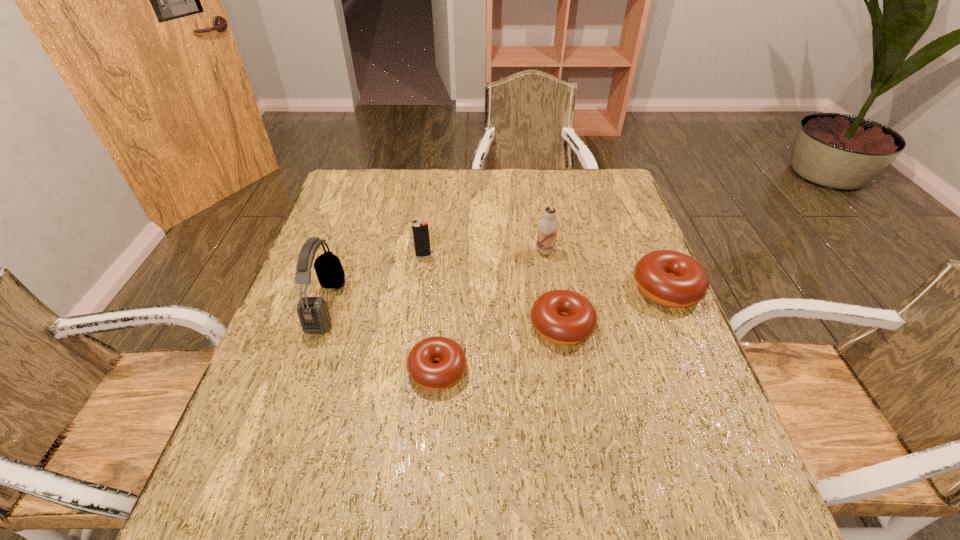
In the image, there is a desktop. What are the coordinates of `blank space at the right edge` in the screenshot? It's located at (593, 248).

Where is `vacant space at the far right corner of the desktop`? vacant space at the far right corner of the desktop is located at coordinates (624, 201).

At what (x,y) coordinates should I click in order to perform the action: click on empty space between the second doughnut from right to left and the igniter. Please return your answer as a coordinate pair (x, y). This screenshot has height=540, width=960. Looking at the image, I should click on (492, 291).

This screenshot has width=960, height=540. Identify the location of free space between the chocolate milk and the second shortest object. (553, 288).

Identify the location of vacant space in between the igniter and the chocolate milk. The image size is (960, 540). (484, 253).

At what (x,y) coordinates should I click in order to perform the action: click on empty space that is in between the rightmost doughnut and the chocolate milk. Please return your answer as a coordinate pair (x, y). Image resolution: width=960 pixels, height=540 pixels. Looking at the image, I should click on (606, 270).

Where is `free area in between the second tallest object and the second tallest doughnut`? The height and width of the screenshot is (540, 960). free area in between the second tallest object and the second tallest doughnut is located at coordinates (553, 288).

The image size is (960, 540). Find the location of `free space between the igniter and the rightmost doughnut`. free space between the igniter and the rightmost doughnut is located at coordinates (545, 272).

This screenshot has width=960, height=540. In order to click on vacant area that lies between the rightmost object and the fifth tallest object in this screenshot , I will do `click(614, 307)`.

In order to click on blank region between the shortest doughnut and the second tallest object in this screenshot , I will do `click(492, 310)`.